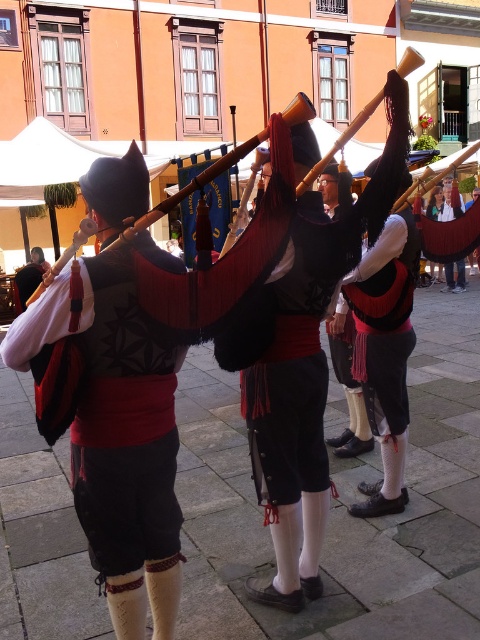
Where is the matte black vest at center located in the image?

The matte black vest at center is located at point 0.570 on the x axis and 0.802 on the y axis.

You are a photographer trying to capture the perfect shot of the matte black vest at center and the matte red bagpipe at center. Which object should you focus on first if you want to ensure both are in sharp focus?

The matte black vest at center is located below the matte red bagpipe at center. Since the vest is lower, you should focus on the matte red bagpipe at center first as it is higher and might be more prominent in the frame.

In the scene of three people playing bagpipes, you notice the matte black vest at center and the matte red bagpipe at center. From the perspective of someone standing in front of them, which object is positioned to the right?

The matte black vest at center is to the right of the matte red bagpipe at center.